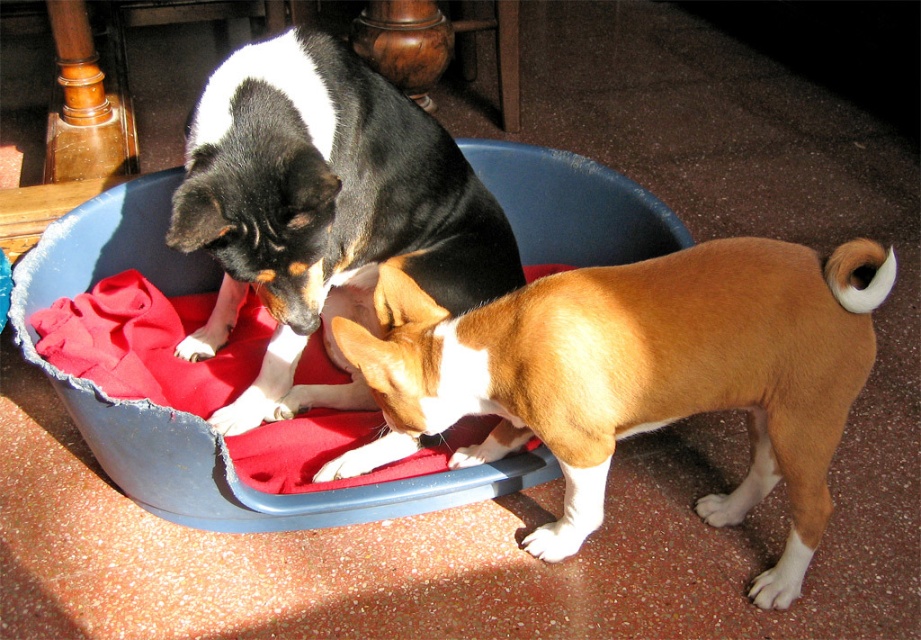
In the scene shown: Between brown/white fur dog at center and black and white fur dog at center, which one is positioned higher?

black and white fur dog at center is above.

Which is more to the left, brown/white fur dog at center or black and white fur dog at center?

black and white fur dog at center is more to the left.

Image resolution: width=921 pixels, height=640 pixels. Describe the element at coordinates (647, 376) in the screenshot. I see `brown/white fur dog at center` at that location.

The width and height of the screenshot is (921, 640). In order to click on brown/white fur dog at center in this screenshot , I will do `click(647, 376)`.